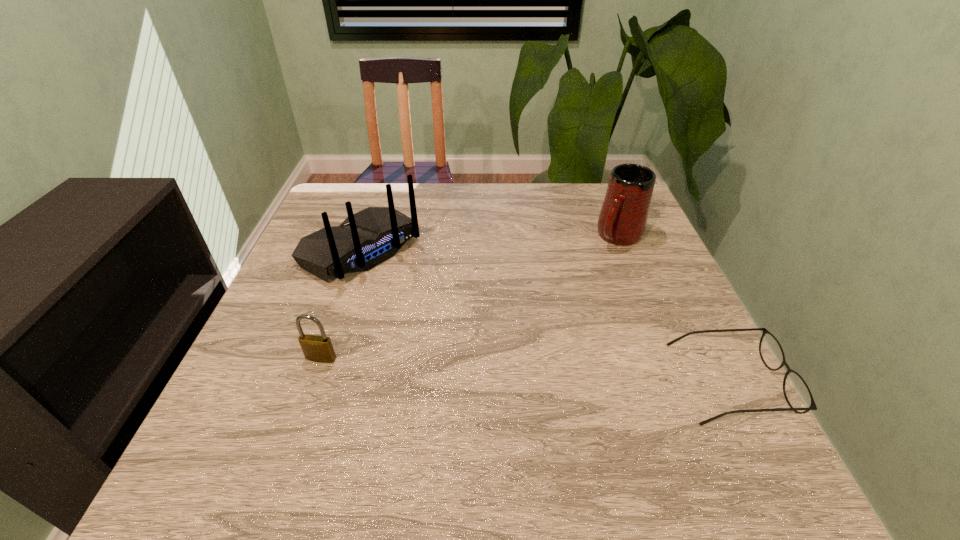
Find the location of a particular element. vacant space located on the side of the mug with the handle is located at coordinates (544, 319).

At what (x,y) coordinates should I click in order to perform the action: click on router at the far edge. Please return your answer as a coordinate pair (x, y). This screenshot has width=960, height=540. Looking at the image, I should click on (363, 240).

The width and height of the screenshot is (960, 540). In order to click on mug present at the far edge in this screenshot , I will do `click(622, 221)`.

You are a GUI agent. You are given a task and a screenshot of the screen. Output one action in this format:
    pyautogui.click(x=<x>, y=<y>)
    Task: Click on the object situated at the near edge
    
    Given the screenshot: What is the action you would take?
    pyautogui.click(x=797, y=393)

The height and width of the screenshot is (540, 960). I want to click on padlock present at the left edge, so click(315, 348).

This screenshot has width=960, height=540. I want to click on router that is at the left edge, so click(363, 240).

I want to click on spectacles that is at the right edge, so click(x=797, y=393).

You are a GUI agent. You are given a task and a screenshot of the screen. Output one action in this format:
    pyautogui.click(x=<x>, y=<y>)
    Task: Click on the mug that is at the right edge
    The width and height of the screenshot is (960, 540).
    Given the screenshot: What is the action you would take?
    pyautogui.click(x=622, y=221)

The height and width of the screenshot is (540, 960). What are the coordinates of `object located at the far left corner` in the screenshot? It's located at (363, 240).

Image resolution: width=960 pixels, height=540 pixels. In order to click on object present at the far right corner in this screenshot , I will do `click(622, 221)`.